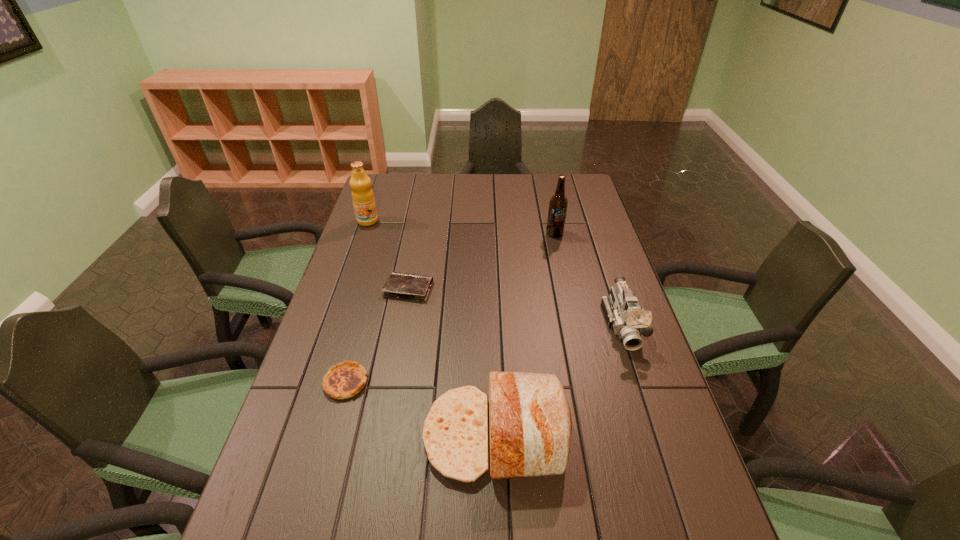
You are a GUI agent. You are given a task and a screenshot of the screen. Output one action in this format:
    pyautogui.click(x=<x>, y=<y>)
    Task: Click on the free space that satisfies the following two spatial constraints: 1. on the front label of the quiche; 2. on the left side of the fruit juice
    
    Given the screenshot: What is the action you would take?
    pyautogui.click(x=313, y=382)

Where is `free space that satisfies the following two spatial constraints: 1. on the front label of the quiche; 2. on the left side of the farthest object`? This screenshot has width=960, height=540. free space that satisfies the following two spatial constraints: 1. on the front label of the quiche; 2. on the left side of the farthest object is located at coordinates (313, 382).